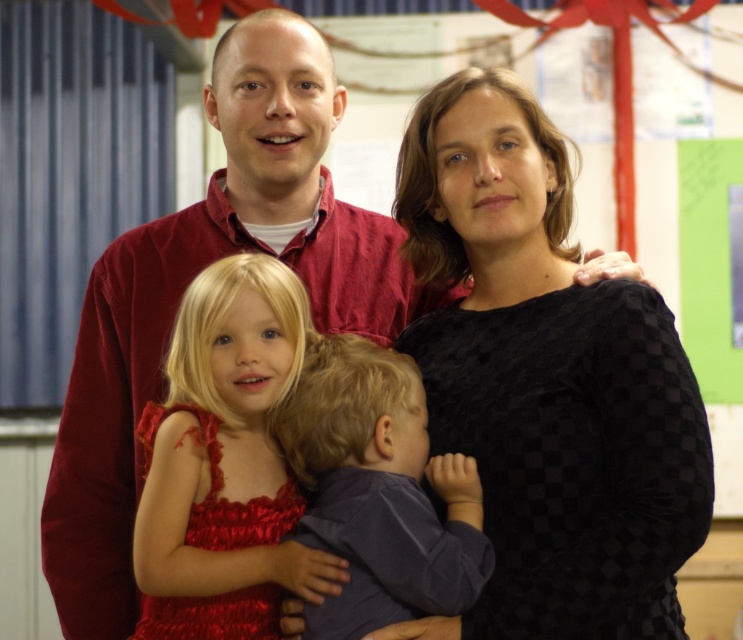
You are a photographer who wants to ensure the dresses are visible in the photo. Which dress should you focus on to ensure the black checkered dress at center and shiny red dress at center are both in focus?

The black checkered dress at center is positioned over the shiny red dress at center, so focusing on the black checkered dress at center will ensure both are in focus.

You are a photographer who needs to adjust the distance between the black checkered dress at center and the matte purple shirt at center to 8 inches for a better composition. Currently, how much farther apart should you move them?

The black checkered dress at center is currently 6.70 inches away from the matte purple shirt at center. To reach the desired 8 inches, they need to be moved an additional 1.30 inches apart.

You are standing in the room and want to take a photo of the family. The camera you are using has a focus range of 7 feet to 10 feet. Is the point at coordinates point (629, 460) within the camera focus range?

The distance of point (629, 460) from camera is 7.38 feet, which is within the camera focus range of 7 feet to 10 feet. The point is within the focus range.